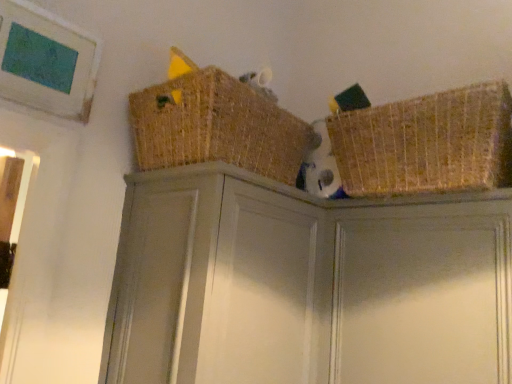
Question: Is matte gray cabinet at center positioned beyond the bounds of woven straw basket at upper center, the second basket in the right-to-left sequence?

Choices:
 (A) no
 (B) yes

Answer: (B)

Question: From a real-world perspective, does matte gray cabinet at center stand above woven straw basket at upper center, the second basket in the right-to-left sequence?

Choices:
 (A) no
 (B) yes

Answer: (A)

Question: Does matte gray cabinet at center have a larger size compared to woven straw basket at upper center, the 1th basket positioned from the left?

Choices:
 (A) yes
 (B) no

Answer: (A)

Question: Is matte gray cabinet at center not near woven straw basket at upper center, the second basket in the right-to-left sequence?

Choices:
 (A) yes
 (B) no

Answer: (B)

Question: Is matte gray cabinet at center further to the viewer compared to woven straw basket at upper center, the 1th basket positioned from the left?

Choices:
 (A) no
 (B) yes

Answer: (A)

Question: From the image's perspective, is matte gray cabinet at center on woven straw basket at upper center, the 1th basket positioned from the left?

Choices:
 (A) no
 (B) yes

Answer: (A)

Question: Is matte gray cabinet at center bigger than woven straw basket at upper right, the first basket viewed from the right?

Choices:
 (A) yes
 (B) no

Answer: (A)

Question: Does matte gray cabinet at center contain woven straw basket at upper right, the first basket viewed from the right?

Choices:
 (A) no
 (B) yes

Answer: (A)

Question: From a real-world perspective, is matte gray cabinet at center over woven straw basket at upper right, which appears as the 2th basket when viewed from the left?

Choices:
 (A) no
 (B) yes

Answer: (A)

Question: From the image's perspective, is matte gray cabinet at center below woven straw basket at upper right, the first basket viewed from the right?

Choices:
 (A) yes
 (B) no

Answer: (A)

Question: Could you tell me if matte gray cabinet at center is turned towards woven straw basket at upper right, which appears as the 2th basket when viewed from the left?

Choices:
 (A) yes
 (B) no

Answer: (B)

Question: From the image's perspective, would you say matte gray cabinet at center is positioned over woven straw basket at upper right, the first basket viewed from the right?

Choices:
 (A) no
 (B) yes

Answer: (A)

Question: Is matte gray cabinet at upper right looking in the opposite direction of matte gray cabinet at center?

Choices:
 (A) no
 (B) yes

Answer: (A)